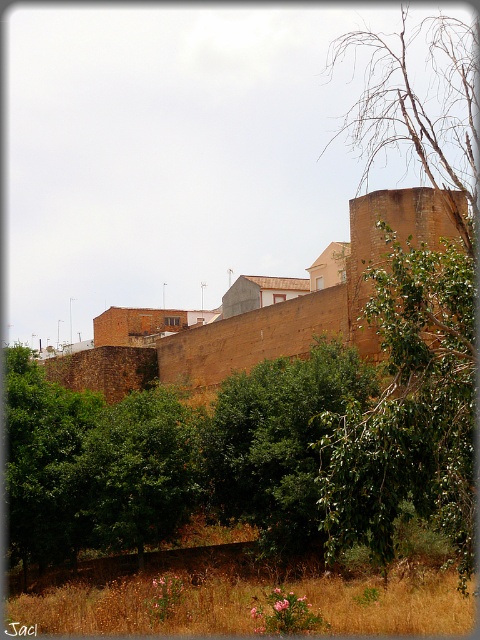
Question: Which point is farther from the camera taking this photo?

Choices:
 (A) (359, 472)
 (B) (267, 464)

Answer: (B)

Question: Which point is farther from the camera taking this photo?

Choices:
 (A) 259,474
 (B) 388,538

Answer: (A)

Question: Can you confirm if green leafy tree at right is wider than green leafy tree at center?

Choices:
 (A) no
 (B) yes

Answer: (A)

Question: Can you confirm if green leafy tree at right is smaller than green leafy tree at center?

Choices:
 (A) yes
 (B) no

Answer: (B)

Question: Can you confirm if green leafy tree at right is wider than green leafy tree at center?

Choices:
 (A) yes
 (B) no

Answer: (B)